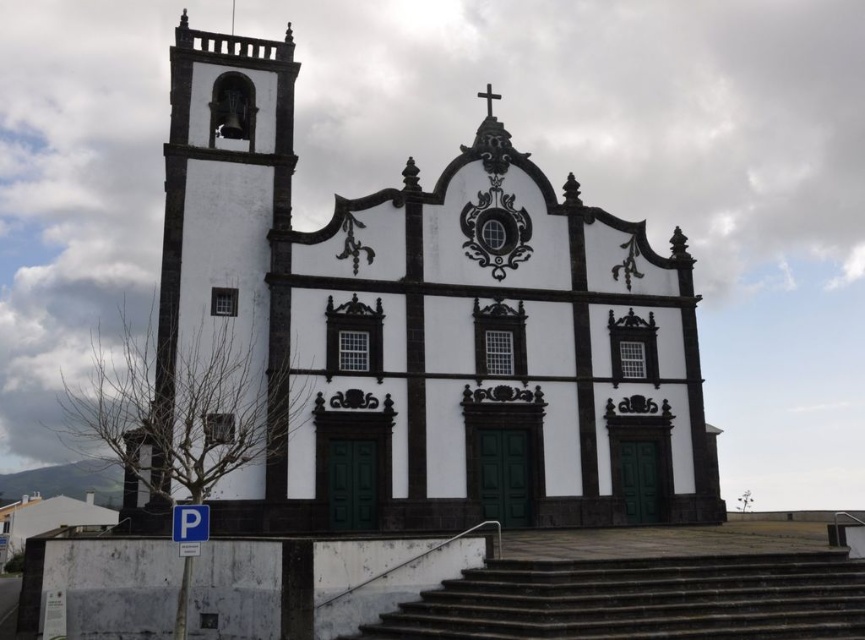
You are standing in front of the church and need to locate the white painted stone chapel at center. According to the coordinates provided, where exactly is it positioned?

The white painted stone chapel at center is located at point (x=427, y=326), which places it near the central area of the image.

You are standing at the entrance of the church and want to locate the white painted stone chapel at center. Based on its coordinates, in which direction should you look?

The white painted stone chapel at center is located at coordinates point (427, 326), which is nearly the center of the image. Therefore, you should look straight ahead to find it.

You are standing in a park across from the white painted stone chapel at center. You want to take a photo of the chapel but your camera can only focus on objects within 50 meters. Will the chapel be in focus?

The white painted stone chapel at center is 51.84 meters from viewer, so it is beyond the camera focus range of 50 meters. The chapel will not be in focus.